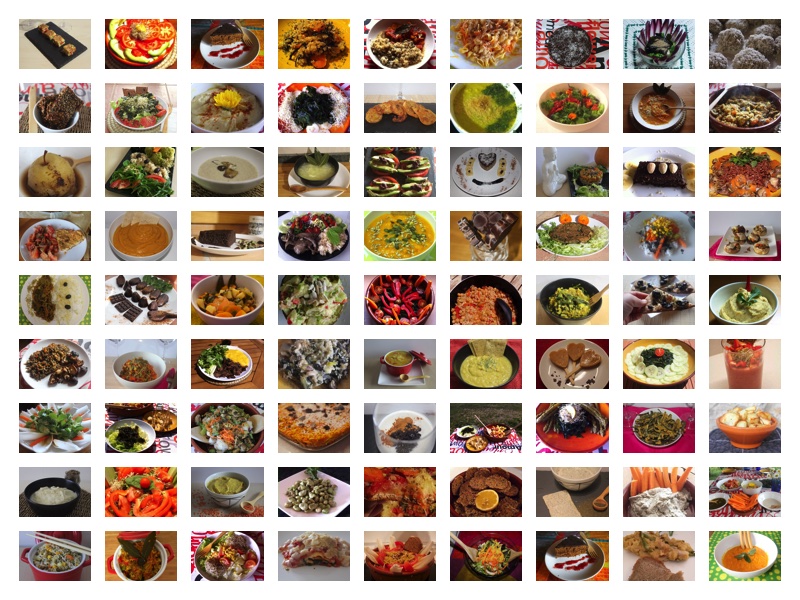
Identify the location of pictures in the bottom row. (60, 557), (112, 548), (224, 543), (294, 546), (390, 558), (474, 547), (545, 542), (653, 558), (718, 554).